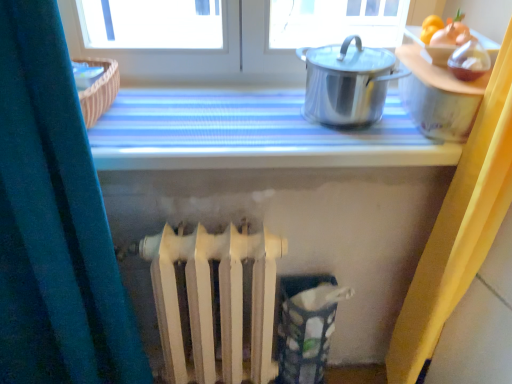
Question: Is metallic silver pot at upper right further to camera compared to white matte radiator at center?

Choices:
 (A) yes
 (B) no

Answer: (A)

Question: Is metallic silver pot at upper right positioned far away from white matte radiator at center?

Choices:
 (A) no
 (B) yes

Answer: (A)

Question: Is metallic silver pot at upper right shorter than white matte radiator at center?

Choices:
 (A) no
 (B) yes

Answer: (B)

Question: From the image's perspective, is metallic silver pot at upper right under white matte radiator at center?

Choices:
 (A) yes
 (B) no

Answer: (B)

Question: Is metallic silver pot at upper right aimed at white matte radiator at center?

Choices:
 (A) yes
 (B) no

Answer: (B)

Question: From a real-world perspective, is polished stainless steel pot at upper right above or below white matte radiator at center?

Choices:
 (A) above
 (B) below

Answer: (A)

Question: Based on their positions, is polished stainless steel pot at upper right located to the left or right of white matte radiator at center?

Choices:
 (A) right
 (B) left

Answer: (A)

Question: From the image's perspective, is polished stainless steel pot at upper right above or below white matte radiator at center?

Choices:
 (A) above
 (B) below

Answer: (A)

Question: In terms of height, does polished stainless steel pot at upper right look taller or shorter compared to white matte radiator at center?

Choices:
 (A) short
 (B) tall

Answer: (A)

Question: Is metallic silver pot at upper right wider or thinner than polished stainless steel pot at upper right?

Choices:
 (A) wide
 (B) thin

Answer: (A)

Question: Is metallic silver pot at upper right bigger or smaller than polished stainless steel pot at upper right?

Choices:
 (A) small
 (B) big

Answer: (B)

Question: From the image's perspective, is metallic silver pot at upper right positioned above or below polished stainless steel pot at upper right?

Choices:
 (A) above
 (B) below

Answer: (B)

Question: Is point (226, 119) closer or farther from the camera than point (351, 99)?

Choices:
 (A) farther
 (B) closer

Answer: (A)

Question: Does point (316, 94) appear closer or farther from the camera than point (395, 145)?

Choices:
 (A) closer
 (B) farther

Answer: (B)

Question: From the image's perspective, is polished stainless steel pot at upper right located above or below metallic silver pot at upper right?

Choices:
 (A) above
 (B) below

Answer: (A)